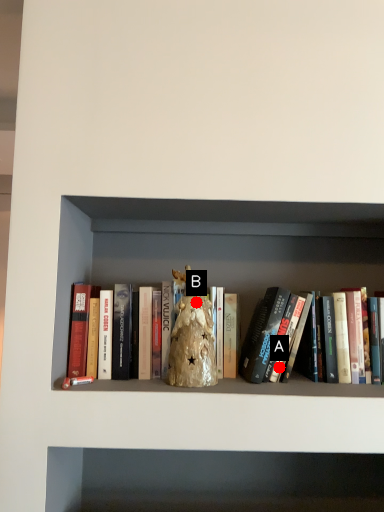
Question: Two points are circled on the image, labeled by A and B beside each circle. Which point is closer to the camera?

Choices:
 (A) A is closer
 (B) B is closer

Answer: (B)